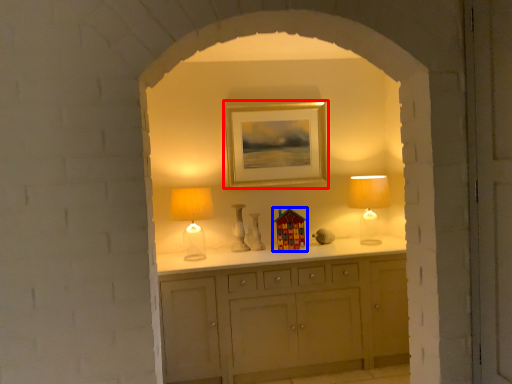
Question: Which object appears closest to the camera in this image, picture frame (highlighted by a red box) or art (highlighted by a blue box)?

Choices:
 (A) picture frame
 (B) art

Answer: (B)